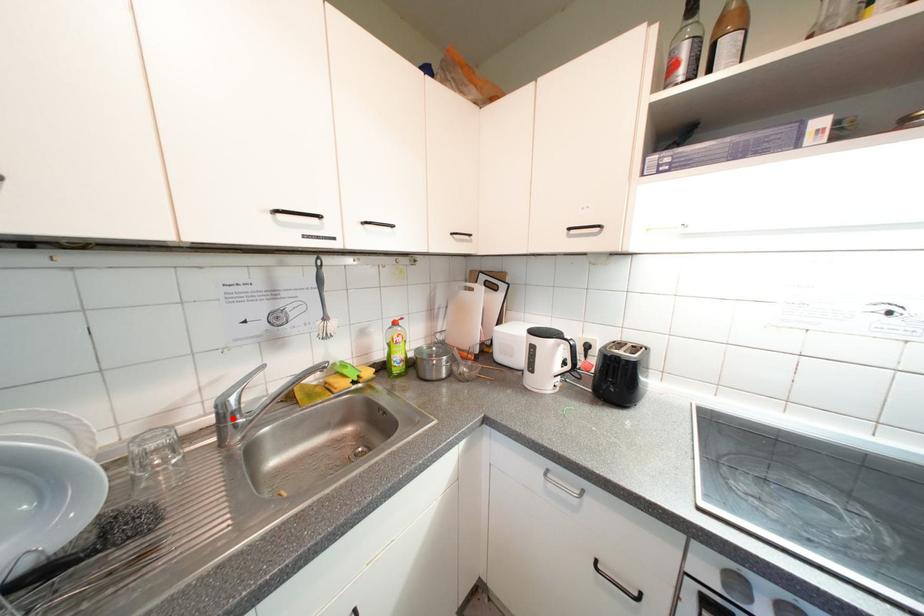
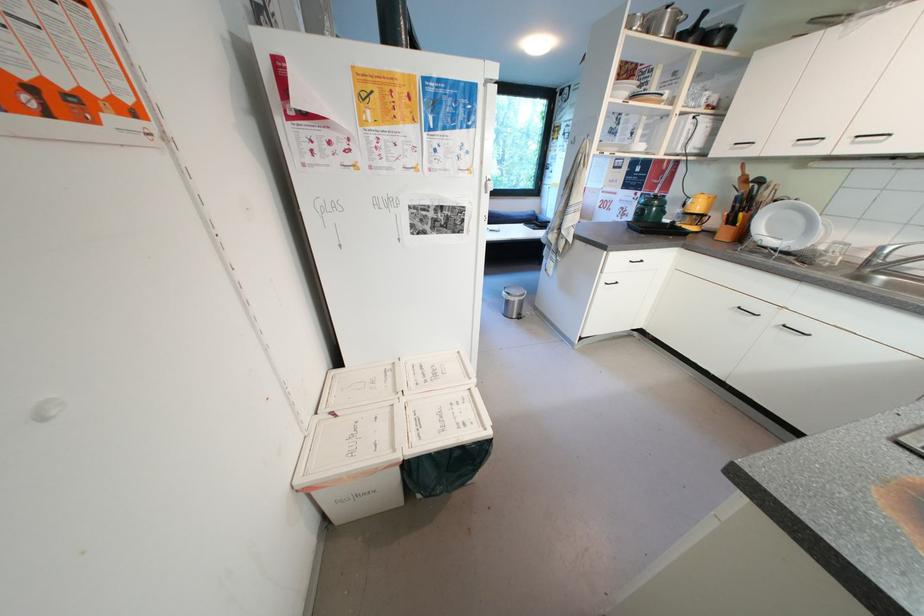
Question: I am providing you with two images of the same scene from different viewpoints. Image1 has a red point marked. In image2, the corresponding 3D location appears at what relative position? Reply with the corresponding letter.

Choices:
 (A) Closer
 (B) Farther

Answer: (B)